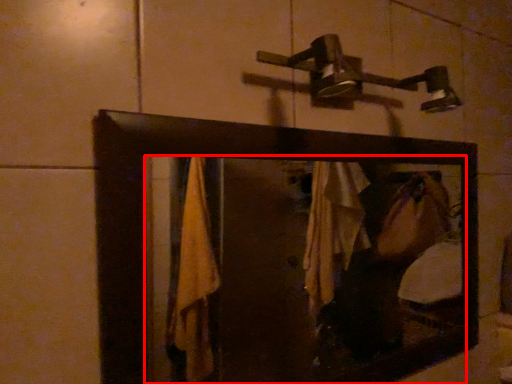
Question: From the image's perspective, what is the correct spatial positioning of mirror (annotated by the red box) in reference to shower?

Choices:
 (A) below
 (B) above

Answer: (A)